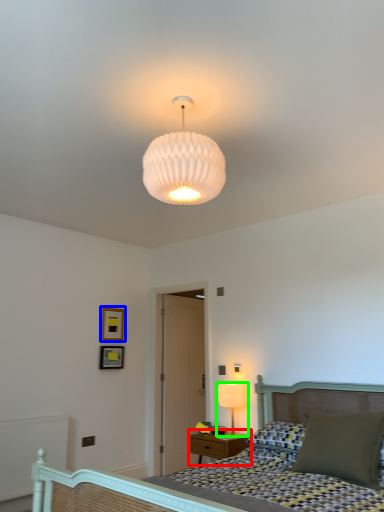
Question: Considering the real-world distances, which object is closest to nightstand (highlighted by a red box)? picture frame (highlighted by a blue box) or lamp (highlighted by a green box).

Choices:
 (A) picture frame
 (B) lamp

Answer: (B)